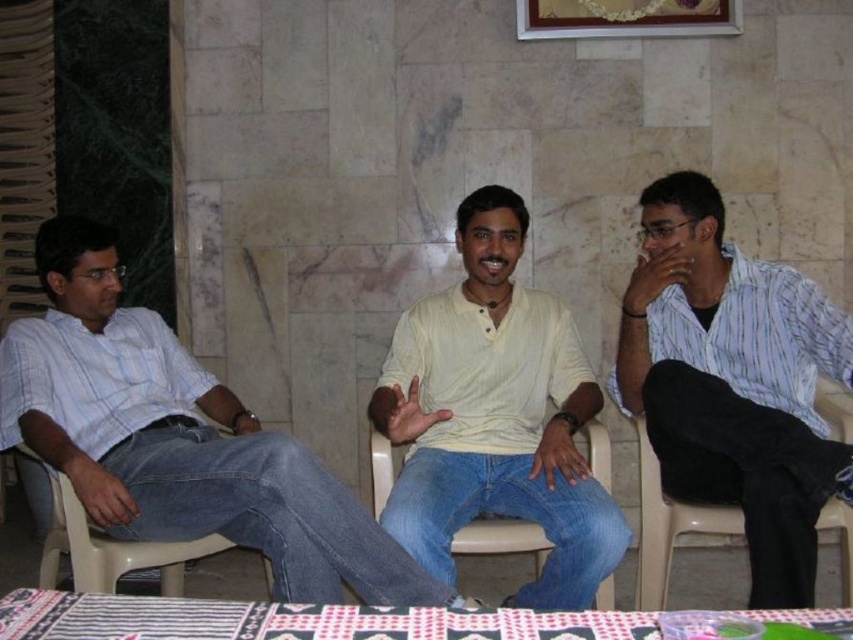
Question: Is the position of light blue denim jeans at left less distant than that of gold-framed picture at upper center?

Choices:
 (A) no
 (B) yes

Answer: (B)

Question: Can you confirm if light blue denim jeans at left is bigger than white plastic chair at center?

Choices:
 (A) yes
 (B) no

Answer: (A)

Question: Among these points, which one is nearest to the camera?

Choices:
 (A) (62, 250)
 (B) (608, 0)

Answer: (A)

Question: Is light blue denim jeans at left positioned at the back of white plastic chair at left?

Choices:
 (A) no
 (B) yes

Answer: (A)

Question: Which point appears closest to the camera in this image?

Choices:
 (A) (708, 296)
 (B) (180, 349)

Answer: (A)

Question: Which point appears farthest from the camera in this image?

Choices:
 (A) (619, 35)
 (B) (36, 456)

Answer: (A)